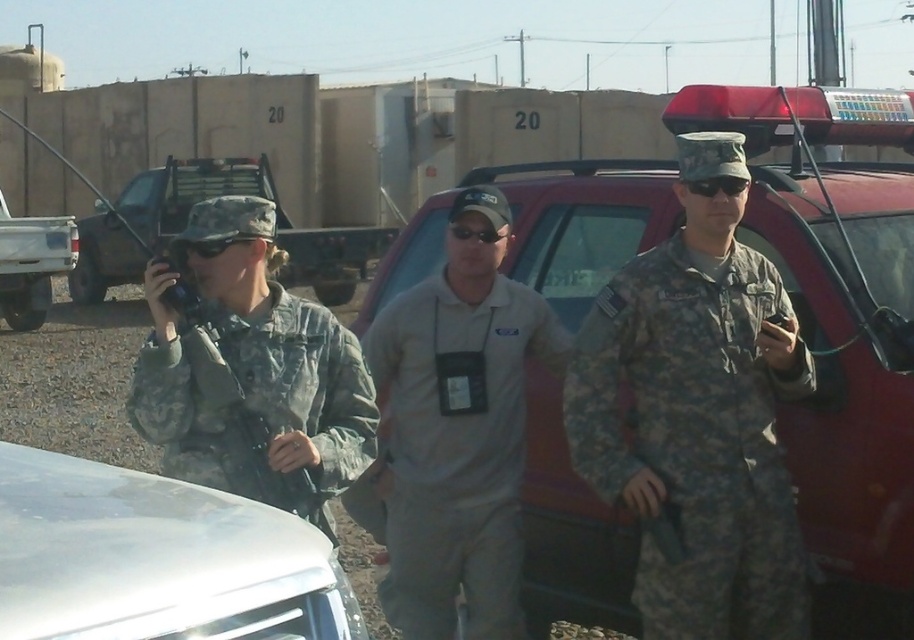
Consider the image. Between gray fabric shirt at center and white glossy car at lower left, which one is positioned lower?

white glossy car at lower left is below.

Which of these two, gray fabric shirt at center or white glossy car at lower left, stands shorter?

white glossy car at lower left is shorter.

Where is `gray fabric shirt at center`? gray fabric shirt at center is located at coordinates (454, 429).

Image resolution: width=914 pixels, height=640 pixels. Identify the location of gray fabric shirt at center. (454, 429).

Is camouflage fabric uniform at right bigger than white glossy car at lower left?

No, camouflage fabric uniform at right is not bigger than white glossy car at lower left.

What do you see at coordinates (696, 436) in the screenshot?
I see `camouflage fabric uniform at right` at bounding box center [696, 436].

Identify the location of camouflage fabric uniform at right. The width and height of the screenshot is (914, 640). (696, 436).

Describe the element at coordinates (696, 436) in the screenshot. I see `camouflage fabric uniform at right` at that location.

Does camouflage fabric uniform at right appear under metallic silver truck at left?

Correct, camouflage fabric uniform at right is located below metallic silver truck at left.

Which is in front, point (731, 362) or point (62, 221)?

Positioned in front is point (731, 362).

At what (x,y) coordinates should I click in order to perform the action: click on camouflage fabric uniform at right. Please return your answer as a coordinate pair (x, y). This screenshot has width=914, height=640. Looking at the image, I should click on (696, 436).